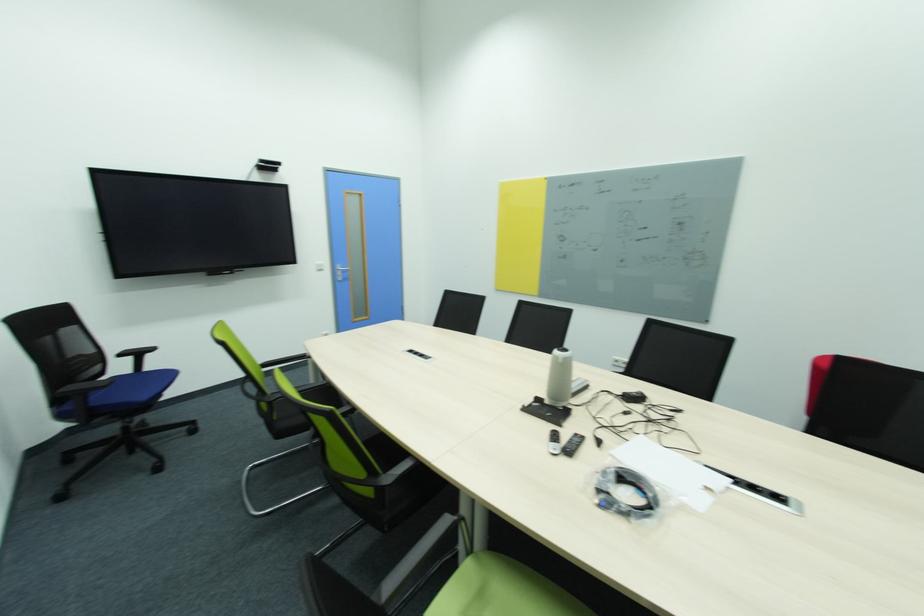
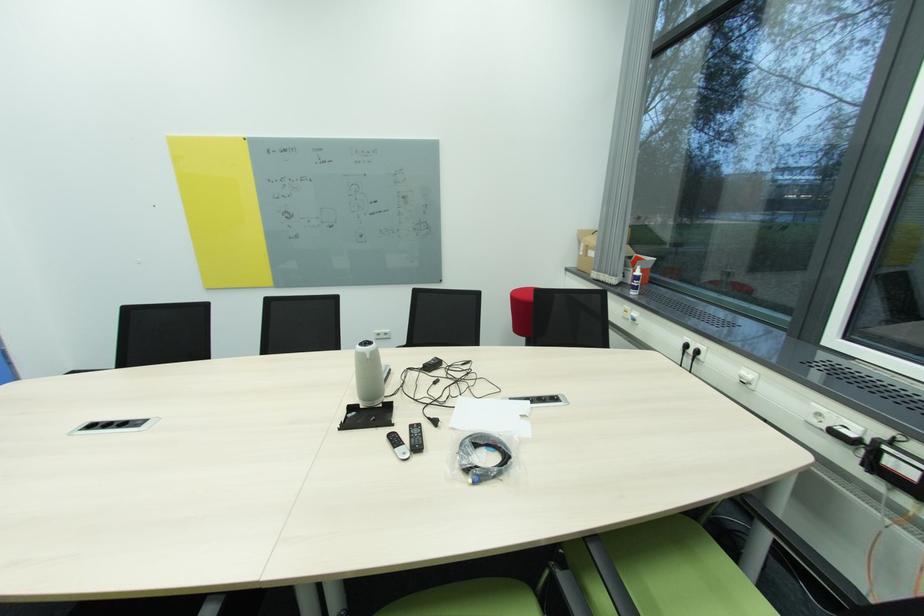
Find the pixel in the second image that matches [564,362] in the first image.

(372, 358)